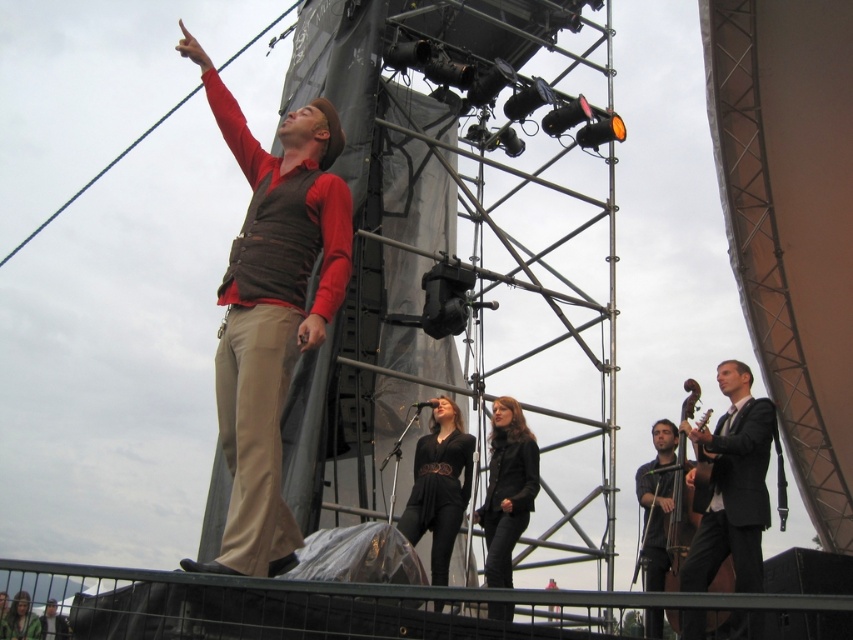
Does black leather dress at center have a lesser height compared to wooden polished bass at right?

Correct, black leather dress at center is not as tall as wooden polished bass at right.

Which is behind, point (444, 540) or point (685, 456)?

The point (685, 456) is more distant.

The height and width of the screenshot is (640, 853). Identify the location of black leather dress at center. (439, 484).

Does matte brown vest at upper left have a smaller size compared to black leather jacket at center?

No, matte brown vest at upper left is not smaller than black leather jacket at center.

Can you confirm if matte brown vest at upper left is positioned below black leather jacket at center?

No.

The height and width of the screenshot is (640, 853). What do you see at coordinates (271, 310) in the screenshot? I see `matte brown vest at upper left` at bounding box center [271, 310].

What are the coordinates of `matte brown vest at upper left` in the screenshot? It's located at (271, 310).

Does matte brown vest at upper left have a smaller size compared to black suit at right?

No.

Does point (256, 426) come behind point (753, 467)?

No, it is in front of (753, 467).

Who is more distant from viewer, (320, 227) or (762, 460)?

The point (762, 460) is more distant.

Where is `matte brown vest at upper left`? The image size is (853, 640). matte brown vest at upper left is located at coordinates (271, 310).